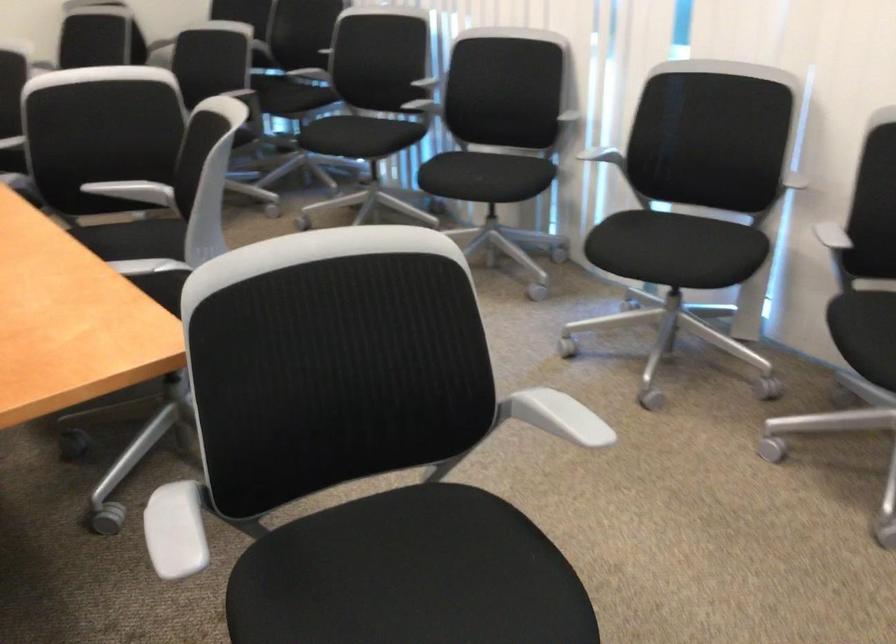
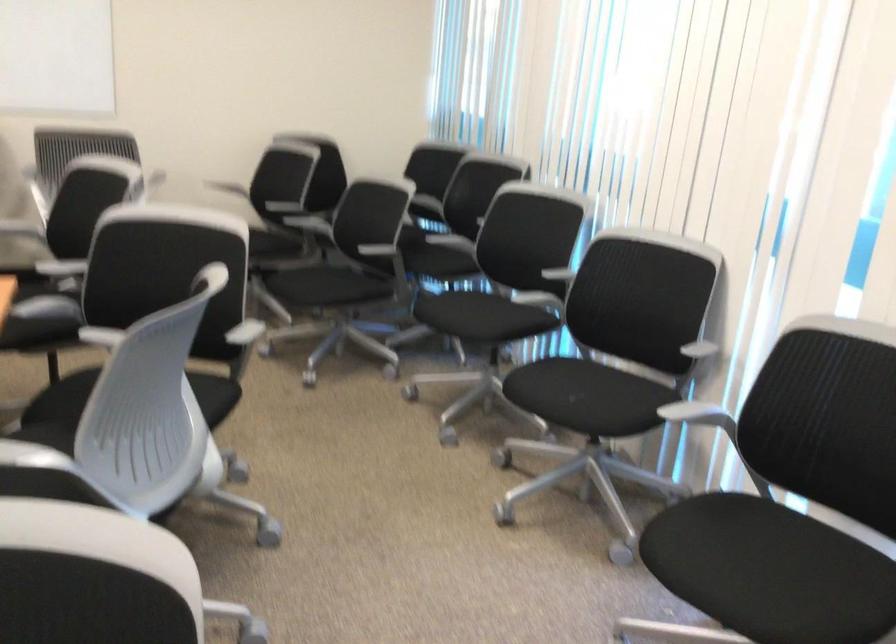
In a continuous first-person perspective shot, in which direction is the camera moving?

The cameraman moved toward right, forward.